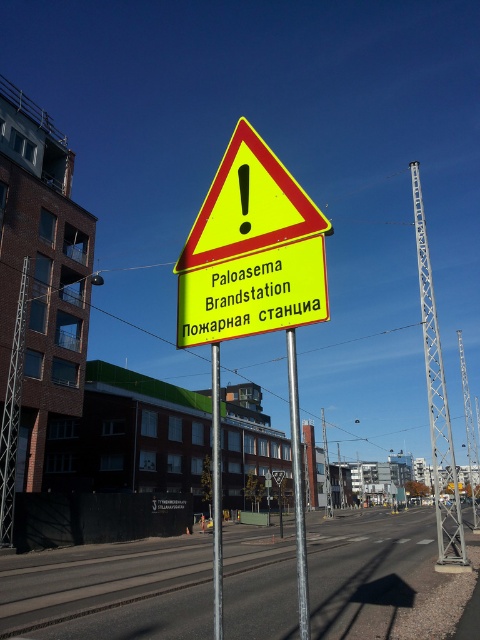
Question: Which point is farther from the camera taking this photo?

Choices:
 (A) (259, 160)
 (B) (445, 547)

Answer: (B)

Question: Is silver metallic pole at right wider than yellow plastic signpost at center?

Choices:
 (A) no
 (B) yes

Answer: (B)

Question: Considering the real-world distances, which object is farthest from the yellow reflective triangle at center?

Choices:
 (A) silver metallic pole at right
 (B) yellow plastic signpost at center
 (C) yellow plastic sign at center

Answer: (A)

Question: Observing the image, what is the correct spatial positioning of silver metallic pole at center in reference to yellow plastic signpost at center?

Choices:
 (A) above
 (B) below

Answer: (A)

Question: Estimate the real-world distances between objects in this image. Which object is closer to the silver metallic pole at right?

Choices:
 (A) yellow plastic signpost at center
 (B) yellow reflective triangle at center

Answer: (B)

Question: Can you confirm if yellow plastic sign at center is positioned above yellow reflective triangle at center?

Choices:
 (A) no
 (B) yes

Answer: (A)